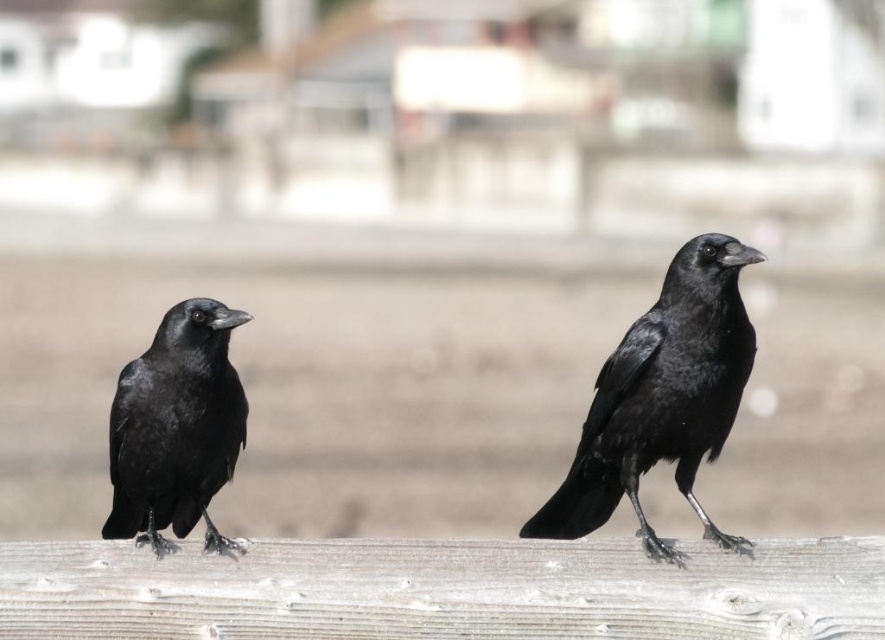
You are a birdwatcher observing two matte black ravens in a beach scene. You notice both the matte black raven at center and the matte black raven at left. Which of these two ravens is positioned to the right of the other?

The matte black raven at center is positioned to the right of the matte black raven at left.

You are a wildlife photographer trying to capture a closeup of the matte black raven at center and the matte black raven at left. Since you want to focus on both birds equally, which bird should you adjust your camera focus on first based on their sizes?

The matte black raven at center is wider than the matte black raven at left, so you should focus on the matte black raven at center first to ensure both birds are in focus.